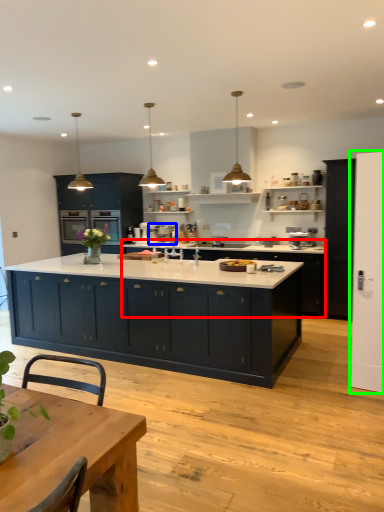
Question: Considering the real-world distances, which object is farthest from cabinetry (highlighted by a red box)? appliance (highlighted by a blue box) or screen door (highlighted by a green box)?

Choices:
 (A) appliance
 (B) screen door

Answer: (B)